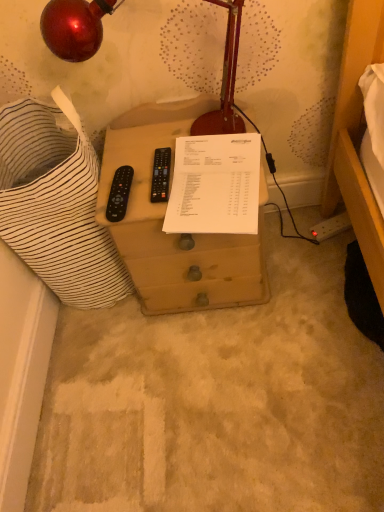
Identify the location of space that is in front of brown wooden drawer at center. (226, 370).